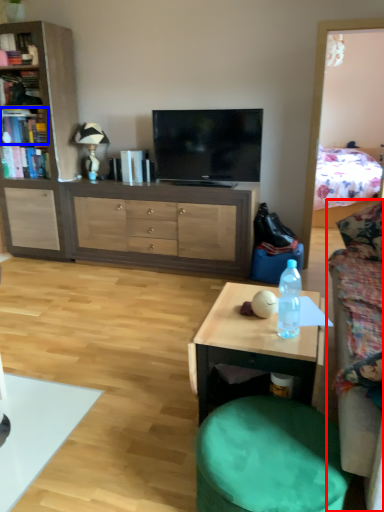
Question: Which of the following is the closest to the observer, studio couch (highlighted by a red box) or book (highlighted by a blue box)?

Choices:
 (A) studio couch
 (B) book

Answer: (A)